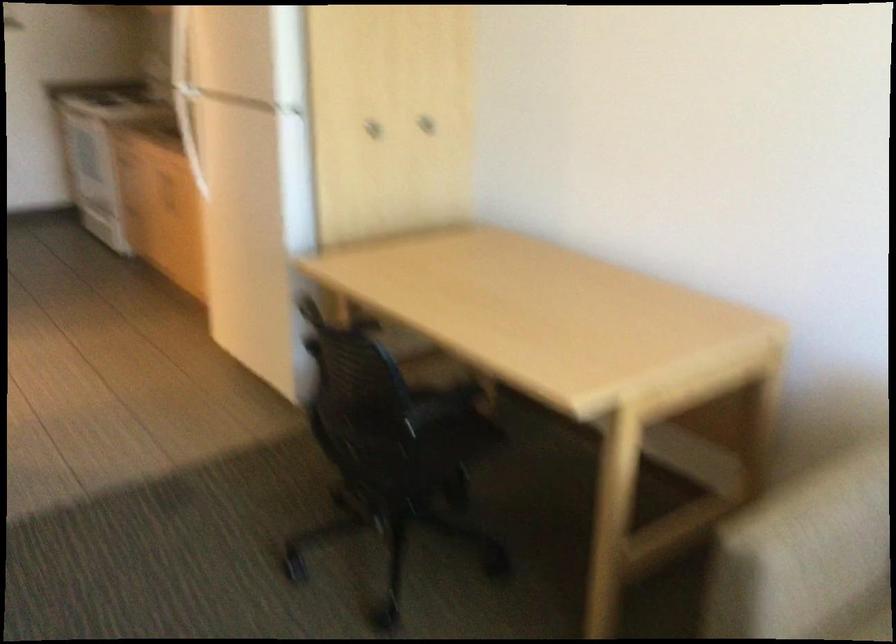
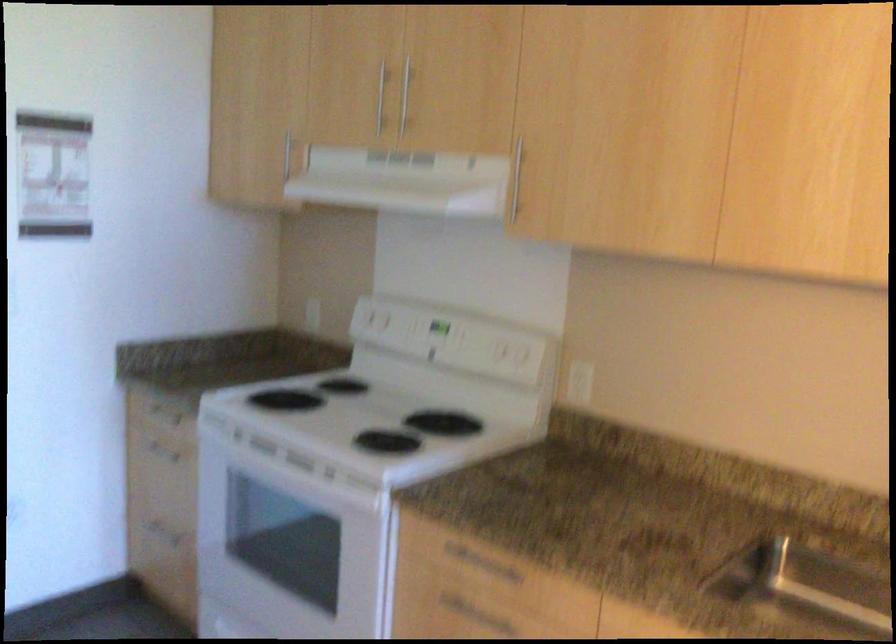
The point at (131, 155) is marked in the first image. Where is the corresponding point in the second image?

(385, 571)